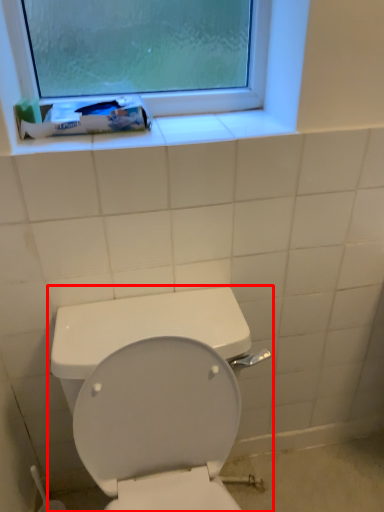
Question: Observing the image, what is the correct spatial positioning of toilet (annotated by the red box) in reference to toothpaste?

Choices:
 (A) right
 (B) left

Answer: (A)